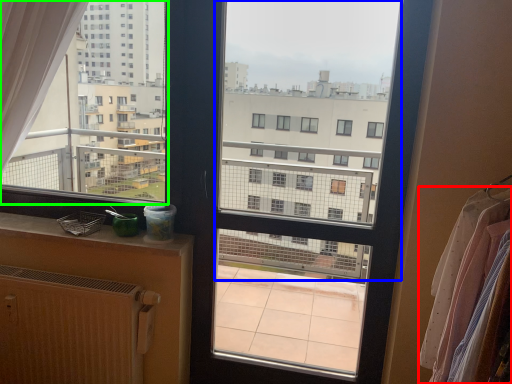
Question: Which object is positioned closest to clothing (highlighted by a red box)? Select from window screen (highlighted by a blue box) and condominium (highlighted by a green box).

Choices:
 (A) window screen
 (B) condominium

Answer: (B)